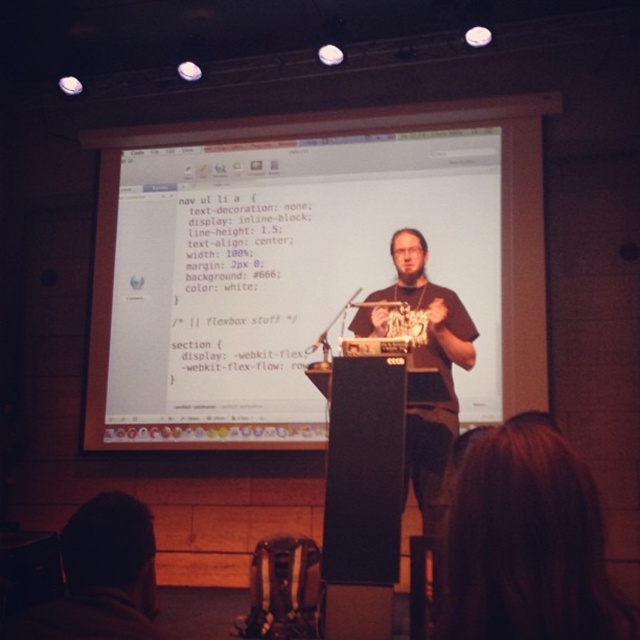
You are attending a presentation and notice the speaker has brown hair at upper center. The screen shows CSS code for a navigation menu. If you want to adjust the text color of the navigation links, which part of the CSS code should you modify?

The brown hair at upper center is located at point (525, 541), but this detail does not relate to the CSS code. To change the text color of the navigation links, you should modify the CSS rule for the selector that targets the navigation links, such as nav ul li a.

You are attending a presentation and notice the speaker standing at the black matte podium at center. You want to get a better look at their dark brown hair at lower left. Can you move around the podium to see it? Explain why or why not based on their positions.

The dark brown hair at lower left is behind the black matte podium at center, so moving around the podium might not help because the hair is already positioned behind the podium from your current viewpoint.